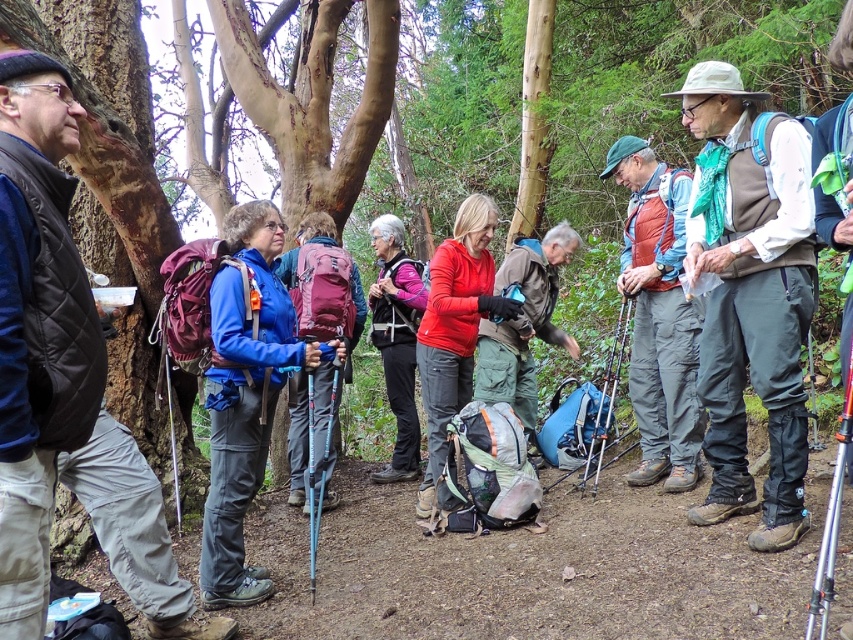
Question: Among these objects, which one is farthest from the camera?

Choices:
 (A) matte red vest at center
 (B) blue fabric jacket at center
 (C) pink fabric vest at center
 (D) matte brown vest at center

Answer: (C)

Question: Can you confirm if blue fabric jacket at center is smaller than matte red jacket at center?

Choices:
 (A) no
 (B) yes

Answer: (A)

Question: Which point is closer to the camera?

Choices:
 (A) (407, 365)
 (B) (657, 413)
 (C) (215, 461)

Answer: (C)

Question: Can you confirm if matte brown vest at center is positioned to the left of matte red vest at center?

Choices:
 (A) yes
 (B) no

Answer: (B)

Question: From the image, what is the correct spatial relationship of blue fabric jacket at center in relation to matte blue jacket at center?

Choices:
 (A) below
 (B) above

Answer: (A)

Question: Which point is closer to the camera?

Choices:
 (A) [711, 113]
 (B) [398, 364]
 (C) [447, 280]
 (D) [532, 413]

Answer: (A)